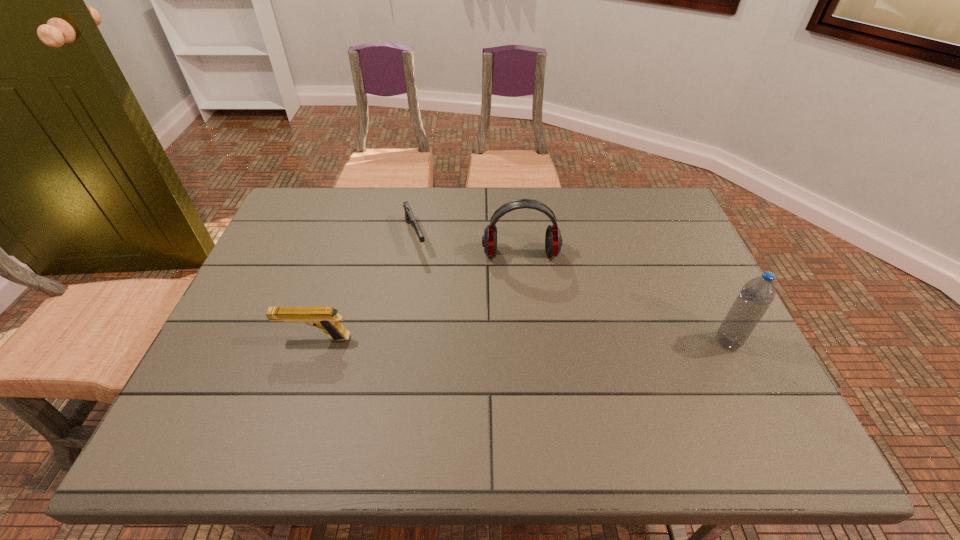
Where is `object that is at the right edge`? This screenshot has width=960, height=540. object that is at the right edge is located at coordinates (756, 296).

The width and height of the screenshot is (960, 540). In the image, there is a desktop. Identify the location of free space at the far edge. (346, 200).

Find the location of a particular element. The image size is (960, 540). free region at the near edge is located at coordinates (350, 380).

The height and width of the screenshot is (540, 960). Find the location of `vacant space at the left edge`. vacant space at the left edge is located at coordinates (282, 355).

Image resolution: width=960 pixels, height=540 pixels. In the image, there is a desktop. Identify the location of vacant space at the right edge. (668, 245).

The height and width of the screenshot is (540, 960). I want to click on vacant space at the far left corner of the desktop, so click(306, 216).

The width and height of the screenshot is (960, 540). I want to click on vacant area between the water bottle and the gun, so click(x=571, y=289).

Find the location of `free space between the rightmost object and the third tallest object`. free space between the rightmost object and the third tallest object is located at coordinates (521, 340).

What are the coordinates of `vacant point located between the second object from right to left and the tallest object` in the screenshot? It's located at (624, 298).

At what (x,y) coordinates should I click in order to perform the action: click on empty space between the earphone and the pistol. Please return your answer as a coordinate pair (x, y). Image resolution: width=960 pixels, height=540 pixels. Looking at the image, I should click on (418, 296).